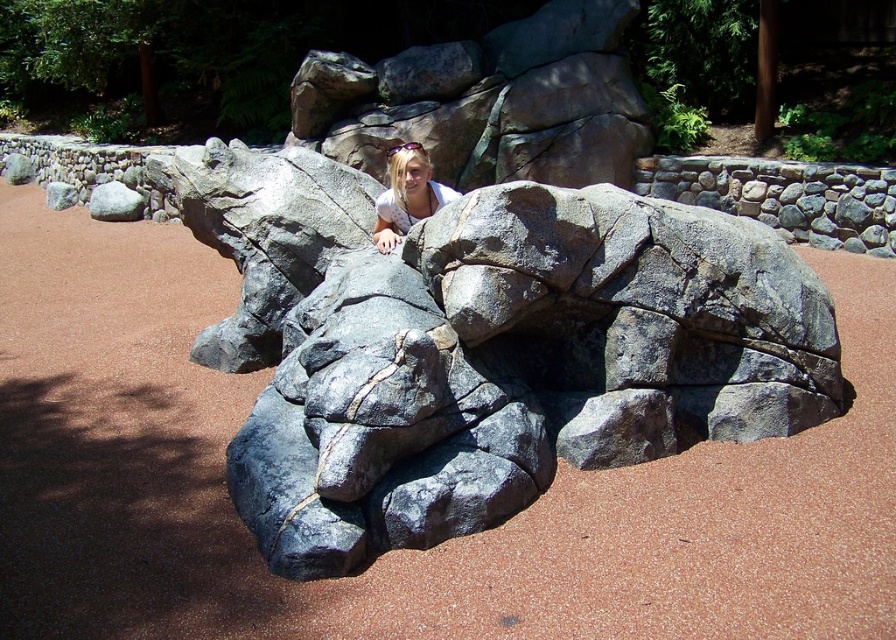
Between gray rough rock at center and blonde hair at center, which one is positioned lower?

gray rough rock at center is lower down.

Which of these two, gray rough rock at center or blonde hair at center, stands shorter?

With less height is blonde hair at center.

Who is more distant from viewer, [336,458] or [392,170]?

Positioned behind is point [392,170].

You are a GUI agent. You are given a task and a screenshot of the screen. Output one action in this format:
    pyautogui.click(x=<x>, y=<y>)
    Task: Click on the gray rough rock at center
    
    Given the screenshot: What is the action you would take?
    pyautogui.click(x=485, y=346)

The image size is (896, 640). Identify the location of blonde hair at center. (407, 195).

Where is `blonde hair at center`? Image resolution: width=896 pixels, height=640 pixels. blonde hair at center is located at coordinates (407, 195).

Does gray rough rock at center have a lesser width compared to gray rough rock at upper left?

No.

Which is behind, point (427, 410) or point (89, 198)?

Point (89, 198)

Measure the distance between point (x=302, y=515) and camera.

Point (x=302, y=515) and camera are 10.90 feet apart.

The width and height of the screenshot is (896, 640). What are the coordinates of `gray rough rock at center` in the screenshot? It's located at (485, 346).